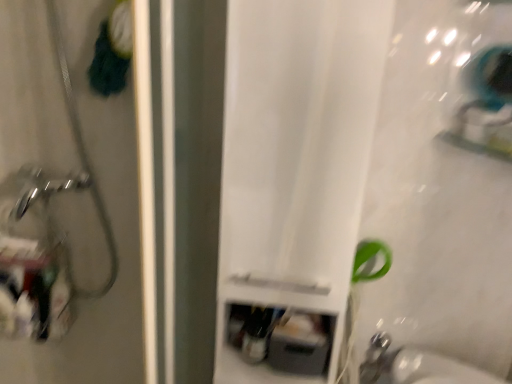
At what (x,y) coordinates should I click in order to perform the action: click on white matte curtain at center. Please return your answer as a coordinate pair (x, y). The image size is (512, 384). Looking at the image, I should click on (295, 161).

Where is `satin nickel faucet at lower right`? This screenshot has width=512, height=384. satin nickel faucet at lower right is located at coordinates (376, 358).

From a real-world perspective, is satin nickel faucet at lower right below white matte curtain at center?

Indeed, from a real-world perspective, satin nickel faucet at lower right is positioned beneath white matte curtain at center.

Considering the sizes of objects satin nickel faucet at lower right and white matte curtain at center in the image provided, who is taller, satin nickel faucet at lower right or white matte curtain at center?

white matte curtain at center is taller.

Which of these two, satin nickel faucet at lower right or white matte curtain at center, is wider?

white matte curtain at center is wider.

Which object is positioned more to the left, brushed metal showerhead at left or satin nickel faucet at lower right?

brushed metal showerhead at left is more to the left.

Which of these two, brushed metal showerhead at left or satin nickel faucet at lower right, is thinner?

Thinner between the two is satin nickel faucet at lower right.

Which of these two, brushed metal showerhead at left or satin nickel faucet at lower right, is smaller?

satin nickel faucet at lower right is smaller.

Which object is further away from the camera, brushed metal showerhead at left or satin nickel faucet at lower right?

satin nickel faucet at lower right is behind.

Would you consider white matte curtain at center to be distant from brushed metal showerhead at left?

white matte curtain at center is near brushed metal showerhead at left, not far away.

What's the angular difference between white matte curtain at center and brushed metal showerhead at left's facing directions?

The facing directions of white matte curtain at center and brushed metal showerhead at left are 0.647 degrees apart.

Based on the photo, is white matte curtain at center in front of brushed metal showerhead at left?

Yes, white matte curtain at center is closer to the camera.

Is point (328, 65) more distant than point (50, 61)?

No, it is not.

Between satin nickel faucet at lower right and brushed metal showerhead at left, which one is positioned behind?

satin nickel faucet at lower right is further from the camera.

Is brushed metal showerhead at left inside satin nickel faucet at lower right?

No, brushed metal showerhead at left is not inside satin nickel faucet at lower right.

Is satin nickel faucet at lower right oriented towards brushed metal showerhead at left?

No, satin nickel faucet at lower right is not facing towards brushed metal showerhead at left.

Considering the relative positions of white matte curtain at center and satin nickel faucet at lower right in the image provided, is white matte curtain at center to the left of satin nickel faucet at lower right from the viewer's perspective?

Yes.

Could you tell me if white matte curtain at center is turned towards satin nickel faucet at lower right?

No, white matte curtain at center is not facing towards satin nickel faucet at lower right.

Which object is more forward, white matte curtain at center or satin nickel faucet at lower right?

white matte curtain at center is closer to the camera.

Looking at the image, does white matte curtain at center seem bigger or smaller compared to satin nickel faucet at lower right?

Considering their sizes, white matte curtain at center takes up more space than satin nickel faucet at lower right.

From the image's perspective, between brushed metal showerhead at left and white matte curtain at center, who is located below?

white matte curtain at center is shown below in the image.

Between brushed metal showerhead at left and white matte curtain at center, which one has larger width?

Wider between the two is white matte curtain at center.

What's the angular difference between brushed metal showerhead at left and white matte curtain at center's facing directions?

There is a 0.647-degree angle between the facing directions of brushed metal showerhead at left and white matte curtain at center.

The width and height of the screenshot is (512, 384). I want to click on curtain that is above the satin nickel faucet at lower right (from the image's perspective), so click(x=295, y=161).

At what (x,y) coordinates should I click in order to perform the action: click on faucet below the brushed metal showerhead at left (from a real-world perspective). Please return your answer as a coordinate pair (x, y). This screenshot has width=512, height=384. Looking at the image, I should click on (376, 358).

From the image, which object appears to be nearer to white matte curtain at center, satin nickel faucet at lower right or brushed metal showerhead at left?

Among the two, brushed metal showerhead at left is located nearer to white matte curtain at center.

Estimate the real-world distances between objects in this image. Which object is further from brushed metal showerhead at left, white matte curtain at center or satin nickel faucet at lower right?

satin nickel faucet at lower right is positioned further to the anchor brushed metal showerhead at left.

Which object lies nearer to the anchor point satin nickel faucet at lower right, white matte curtain at center or brushed metal showerhead at left?

Based on the image, white matte curtain at center appears to be nearer to satin nickel faucet at lower right.

Estimate the real-world distances between objects in this image. Which object is further from satin nickel faucet at lower right, brushed metal showerhead at left or white matte curtain at center?

Among the two, brushed metal showerhead at left is located further to satin nickel faucet at lower right.

When comparing their distances from brushed metal showerhead at left, does satin nickel faucet at lower right or white matte curtain at center seem closer?

white matte curtain at center is positioned closer to the anchor brushed metal showerhead at left.

Estimate the real-world distances between objects in this image. Which object is further from white matte curtain at center, brushed metal showerhead at left or satin nickel faucet at lower right?

satin nickel faucet at lower right is positioned further to the anchor white matte curtain at center.

In order to click on curtain between brushed metal showerhead at left and satin nickel faucet at lower right from left to right in this screenshot , I will do `click(295, 161)`.